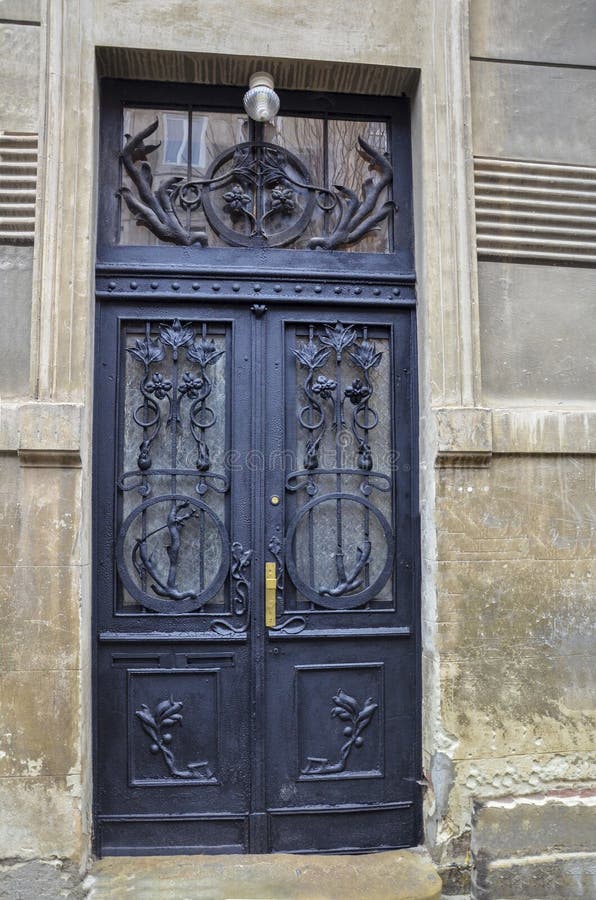
Identify the location of reflection on window. (179, 146), (222, 141), (296, 146), (344, 146).